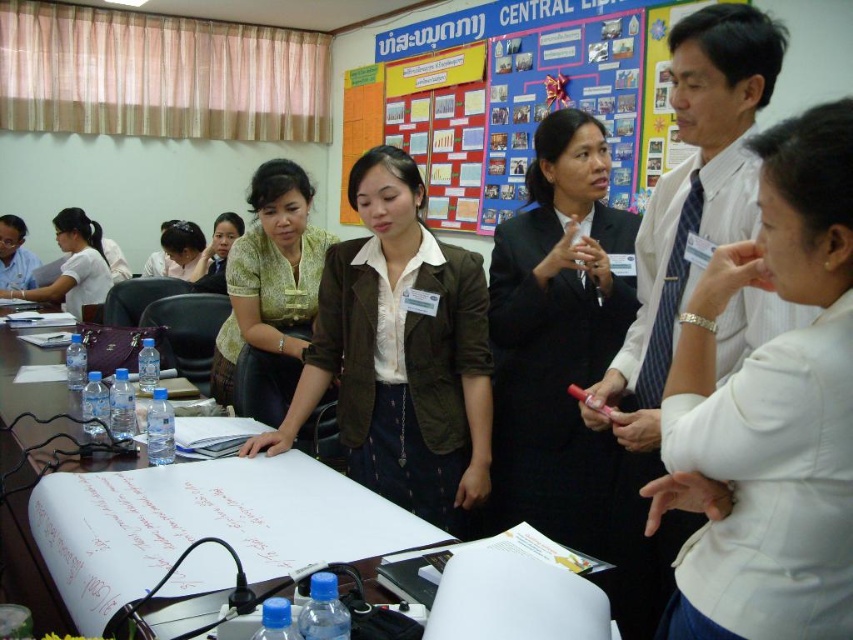
Between blue fabric bulletin board at upper center and black suit at center, which one appears on the right side from the viewer's perspective?

black suit at center

Does blue fabric bulletin board at upper center have a lesser width compared to black suit at center?

In fact, blue fabric bulletin board at upper center might be wider than black suit at center.

Image resolution: width=853 pixels, height=640 pixels. In order to click on blue fabric bulletin board at upper center in this screenshot , I will do `click(517, 106)`.

Who is more distant from viewer, (x=837, y=108) or (x=30, y=294)?

The point (x=30, y=294) is behind.

Find the location of a particular element. The image size is (853, 640). white fabric shirt at center is located at coordinates (773, 406).

Between point (773, 609) and point (62, 298), which one is positioned behind?

The point (62, 298) is behind.

Locate an element on the screen. The image size is (853, 640). white fabric shirt at center is located at coordinates (773, 406).

Locate an element on the screen. The width and height of the screenshot is (853, 640). white fabric shirt at center is located at coordinates 773,406.

Can you confirm if white fabric shirt at center is positioned to the right of matte black hairband at upper left?

Correct, you'll find white fabric shirt at center to the right of matte black hairband at upper left.

Identify the location of white fabric shirt at center. This screenshot has width=853, height=640. (773, 406).